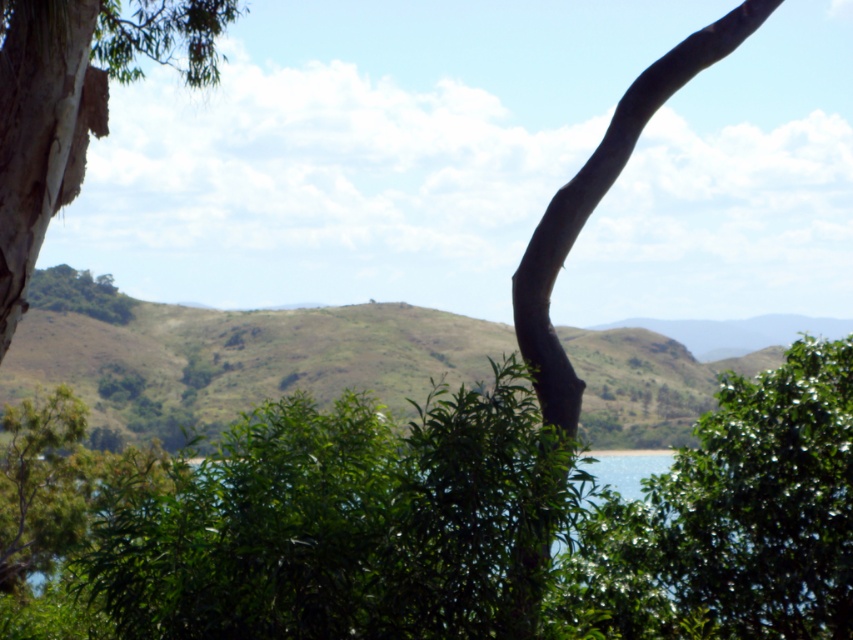
You are standing in the landscape scene and want to take a photo of the green leafy tree at center. If your camera has a focal length of 50mm and you want to fill the frame with the tree, should you move closer or farther away?

The green leafy tree at center is 6.59 meters from camera. To fill the frame with the tree, you should move closer because the tree is currently farther than the optimal distance for a 50mm lens to capture it fully.

You are planning to plant a new tree in your backyard. You want to choose between the green leafy tree at center and the brown rough bark tree at upper right. Considering their sizes, which tree would require more space in your garden?

The green leafy tree at center is larger in size compared to the brown rough bark tree at upper right, so it would require more space in your garden.

You are planning to plant a new tree in your backyard. You have two options based on the image shown. The first option is the green leafy tree at center, and the second is the brown rough bark tree at upper right. Considering their widths, which tree would you choose if you want a wider canopy for shade?

The green leafy tree at center has a larger width than the brown rough bark tree at upper right, so it would provide a wider canopy for shade.